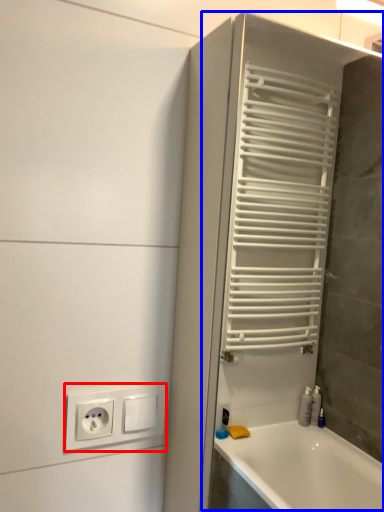
Question: Which object is closer to the camera taking this photo, power plugs and sockets (highlighted by a red box) or screen door (highlighted by a blue box)?

Choices:
 (A) power plugs and sockets
 (B) screen door

Answer: (B)